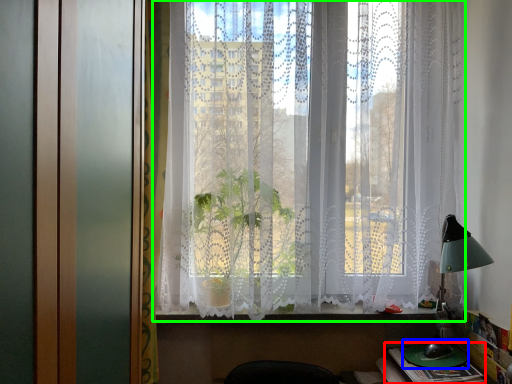
Question: Considering the real-world distances, which object is farthest from book (highlighted by a red box)? round table (highlighted by a blue box) or window (highlighted by a green box)?

Choices:
 (A) round table
 (B) window

Answer: (B)